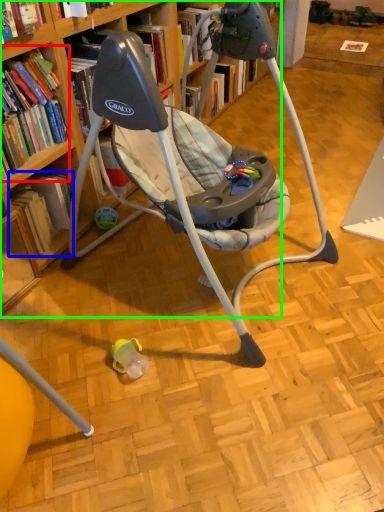
Question: Which object is the closest to the book (highlighted by a red box)? Choose among these: book (highlighted by a blue box) or bookcase (highlighted by a green box).

Choices:
 (A) book
 (B) bookcase

Answer: (A)